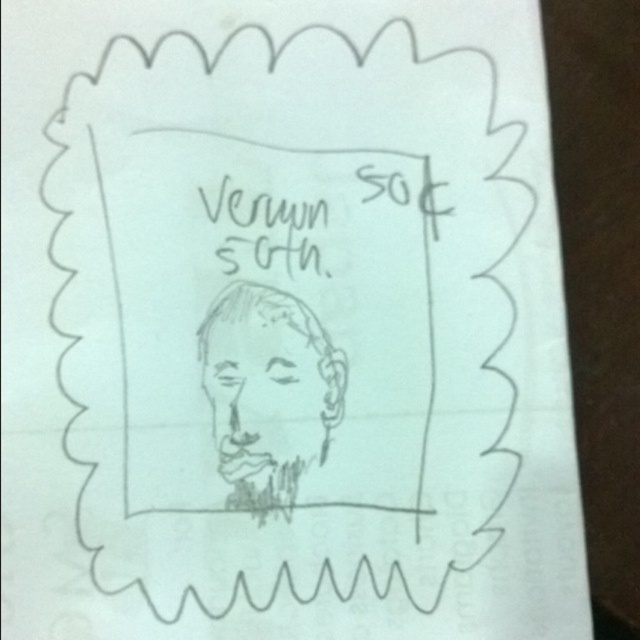
Between sketchy pencil man at center and black ink writing at center, which one is positioned lower?

Positioned lower is sketchy pencil man at center.

Can you confirm if sketchy pencil man at center is bigger than black ink writing at center?

Correct, sketchy pencil man at center is larger in size than black ink writing at center.

The height and width of the screenshot is (640, 640). Find the location of `sketchy pencil man at center`. sketchy pencil man at center is located at coordinates (268, 394).